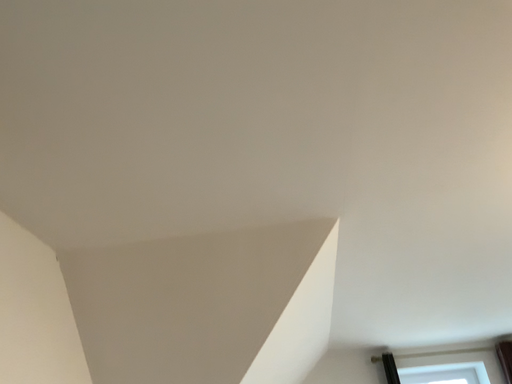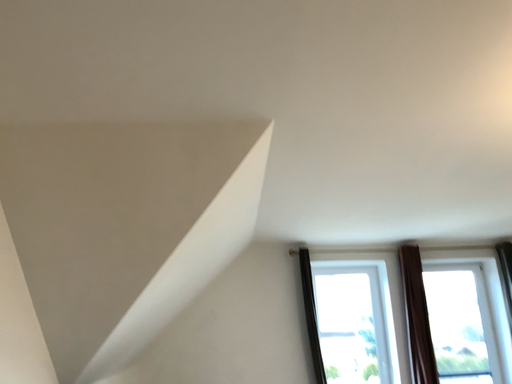
Question: Which way did the camera rotate in the video?

Choices:
 (A) rotated left
 (B) rotated right

Answer: (B)